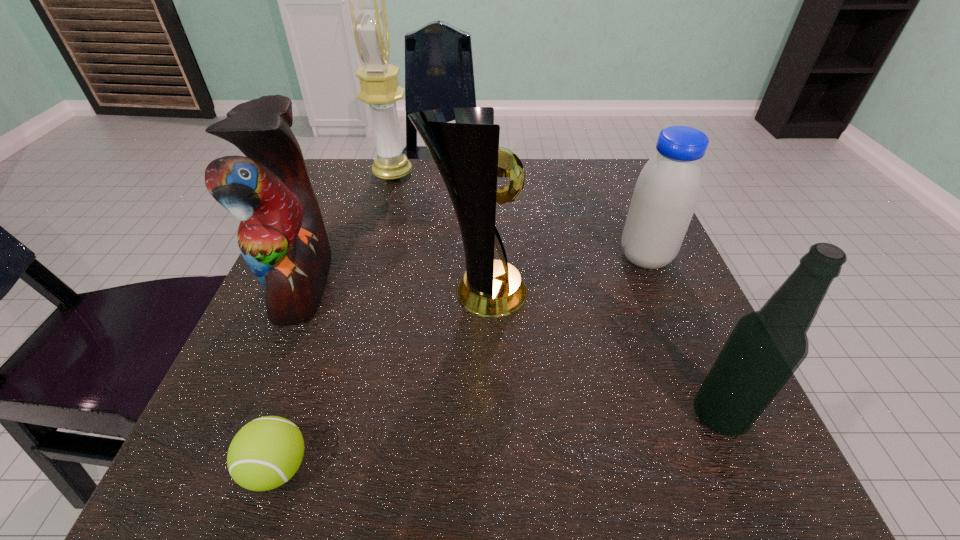
You are a GUI agent. You are given a task and a screenshot of the screen. Output one action in this format:
    pyautogui.click(x=<x>, y=<y>)
    Task: Click on the alcohol present at the right edge
    The image size is (960, 540).
    Given the screenshot: What is the action you would take?
    pyautogui.click(x=766, y=347)

In order to click on soya milk present at the right edge in this screenshot , I will do `click(667, 191)`.

Where is `object that is at the far left corner`? The width and height of the screenshot is (960, 540). object that is at the far left corner is located at coordinates (380, 89).

Locate an element on the screen. object positioned at the near left corner is located at coordinates (265, 453).

Image resolution: width=960 pixels, height=540 pixels. I want to click on object that is at the near right corner, so click(x=766, y=347).

The width and height of the screenshot is (960, 540). I want to click on vacant region at the far edge of the desktop, so click(x=546, y=172).

Image resolution: width=960 pixels, height=540 pixels. I want to click on vacant region at the near edge, so point(627,494).

Find the location of `free space at the right edge of the desktop`. free space at the right edge of the desktop is located at coordinates (625, 306).

Find the location of `vacant region at the far left corner of the desktop`. vacant region at the far left corner of the desktop is located at coordinates (354, 191).

You are a GUI agent. You are given a task and a screenshot of the screen. Output one action in this format:
    pyautogui.click(x=<x>, y=<y>)
    Task: Click on the vacant point at the near left corner
    The image size is (960, 540).
    Given the screenshot: What is the action you would take?
    pyautogui.click(x=199, y=467)